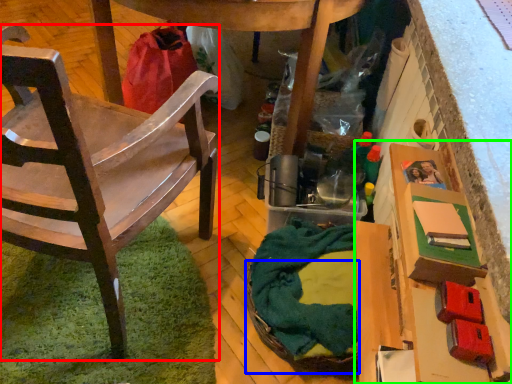
Question: Which is nearer to the chair (highlighted by a red box)? basket (highlighted by a blue box) or cardboard box (highlighted by a green box).

Choices:
 (A) basket
 (B) cardboard box

Answer: (A)